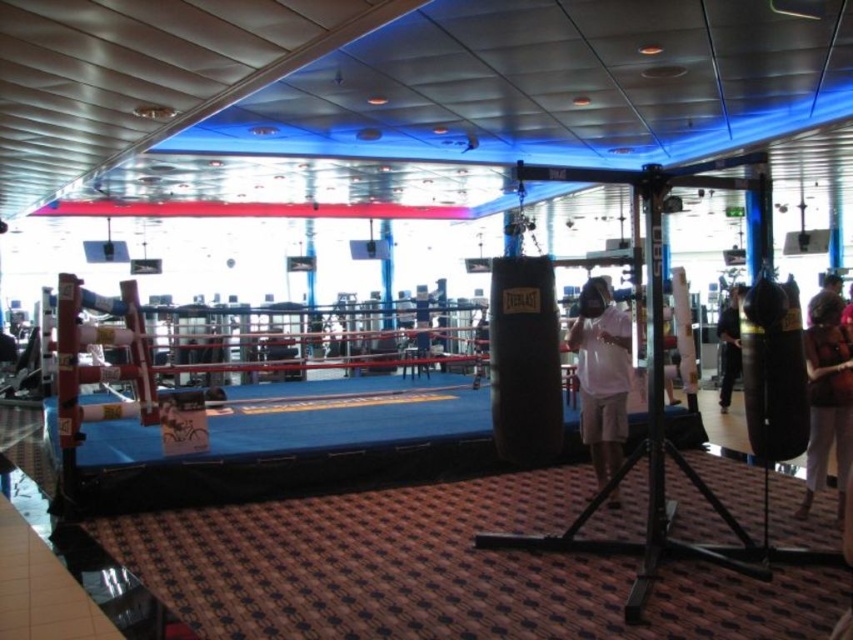
You are an observer in the gym looking at the black fabric pants at lower right and the brown leather jacket at upper right. Which one is positioned lower in the image?

The black fabric pants at lower right is located below the brown leather jacket at upper right, so the black fabric pants at lower right is positioned lower in the image.

You are standing at the entrance of the gym and see the white matte shirt at center. Based on its position, can you estimate how far it is from the boxing ring?

The white matte shirt at center is located at point [601,376], which is relatively close to the boxing ring. Since it is positioned near the center of the gym, it is approximately 3 meters away from the ring.